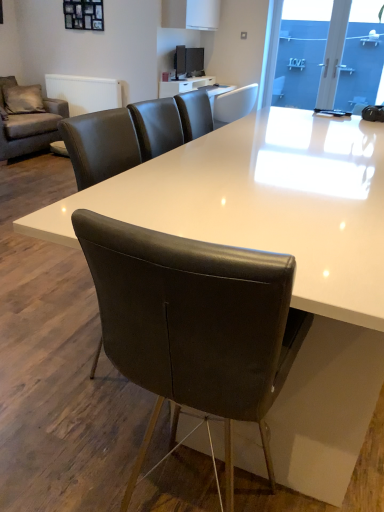
Question: Can you confirm if blue glass door at upper right is bigger than white leather chair at upper center, acting as the second chair starting from the front?

Choices:
 (A) no
 (B) yes

Answer: (A)

Question: Can you confirm if blue glass door at upper right is taller than white leather chair at upper center, which ranks as the 2th chair in bottom-to-top order?

Choices:
 (A) yes
 (B) no

Answer: (A)

Question: From a real-world perspective, is blue glass door at upper right positioned over white leather chair at upper center, the first chair when ordered from top to bottom, based on gravity?

Choices:
 (A) yes
 (B) no

Answer: (A)

Question: Is the position of blue glass door at upper right more distant than that of white leather chair at upper center, the first chair when ordered from top to bottom?

Choices:
 (A) no
 (B) yes

Answer: (A)

Question: From the image's perspective, is blue glass door at upper right over white leather chair at upper center, acting as the second chair starting from the front?

Choices:
 (A) no
 (B) yes

Answer: (B)

Question: Does blue glass door at upper right have a lesser width compared to white leather chair at upper center, which ranks as the 2th chair in bottom-to-top order?

Choices:
 (A) yes
 (B) no

Answer: (A)

Question: From a real-world perspective, does blue glass door at upper right stand above transparent glass door at upper right?

Choices:
 (A) yes
 (B) no

Answer: (B)

Question: Can you confirm if blue glass door at upper right is smaller than transparent glass door at upper right?

Choices:
 (A) no
 (B) yes

Answer: (A)

Question: Is blue glass door at upper right next to transparent glass door at upper right and touching it?

Choices:
 (A) no
 (B) yes

Answer: (A)

Question: Are blue glass door at upper right and transparent glass door at upper right far apart?

Choices:
 (A) yes
 (B) no

Answer: (B)

Question: Considering the relative sizes of blue glass door at upper right and transparent glass door at upper right in the image provided, is blue glass door at upper right wider than transparent glass door at upper right?

Choices:
 (A) yes
 (B) no

Answer: (B)

Question: Is blue glass door at upper right looking in the opposite direction of transparent glass door at upper right?

Choices:
 (A) no
 (B) yes

Answer: (B)

Question: Does white leather chair at upper center, which ranks as the 2th chair in bottom-to-top order, have a greater width compared to blue glass door at upper right?

Choices:
 (A) yes
 (B) no

Answer: (A)